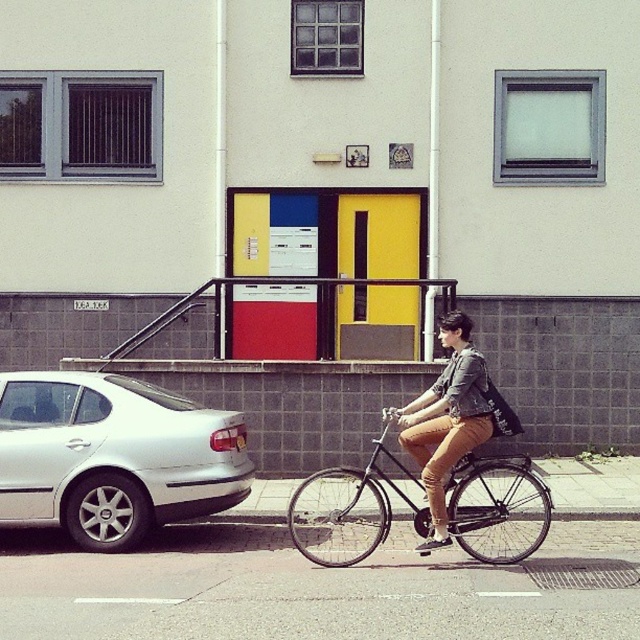
Question: Is silver metallic car at left in front of shiny black bicycle at center?

Choices:
 (A) yes
 (B) no

Answer: (B)

Question: Does silver metallic car at left lie in front of shiny black bicycle at center?

Choices:
 (A) yes
 (B) no

Answer: (B)

Question: Which of the following is the farthest from the observer?

Choices:
 (A) silver metallic car at left
 (B) denim jacket at center
 (C) shiny black bicycle at center

Answer: (A)

Question: Which object is closer to the camera taking this photo?

Choices:
 (A) silver metallic car at left
 (B) shiny black bicycle at center
 (C) denim jacket at center

Answer: (B)

Question: Where is silver metallic car at left located in relation to shiny black bicycle at center in the image?

Choices:
 (A) below
 (B) above

Answer: (B)

Question: Which point is closer to the camera?

Choices:
 (A) (42, 436)
 (B) (474, 348)

Answer: (B)